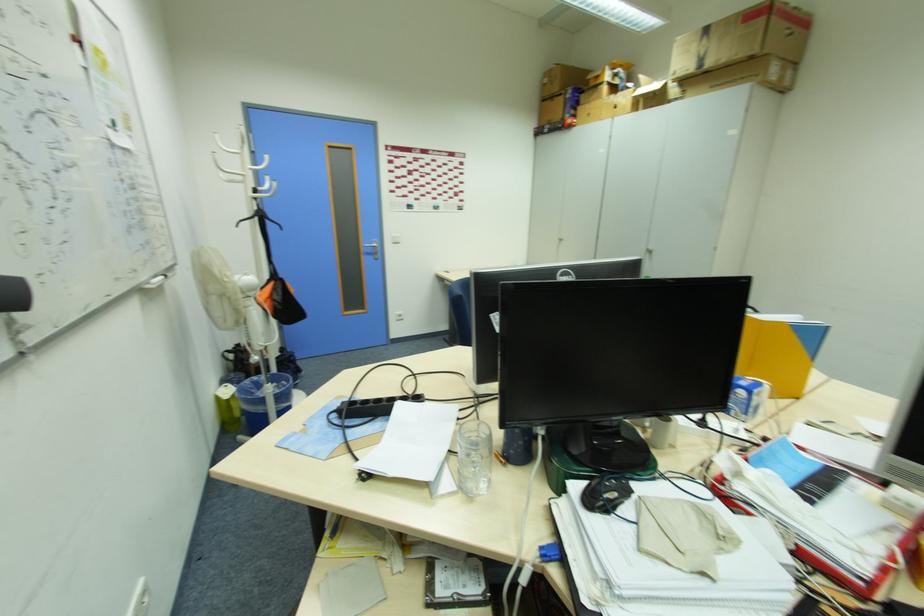
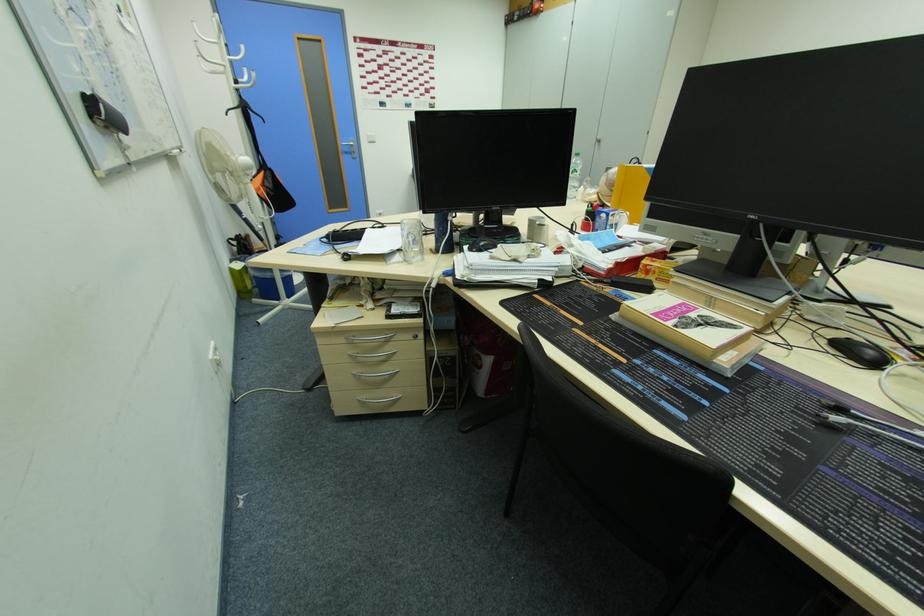
What movement of the cameraman would produce the second image?

The movement direction of the cameraman is right, backward.